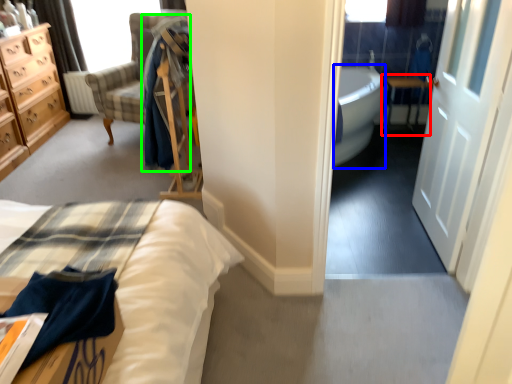
Question: Based on their relative distances, which object is nearer to table (highlighted by a red box)? Choose from bath (highlighted by a blue box) and robe (highlighted by a green box).

Choices:
 (A) bath
 (B) robe

Answer: (A)